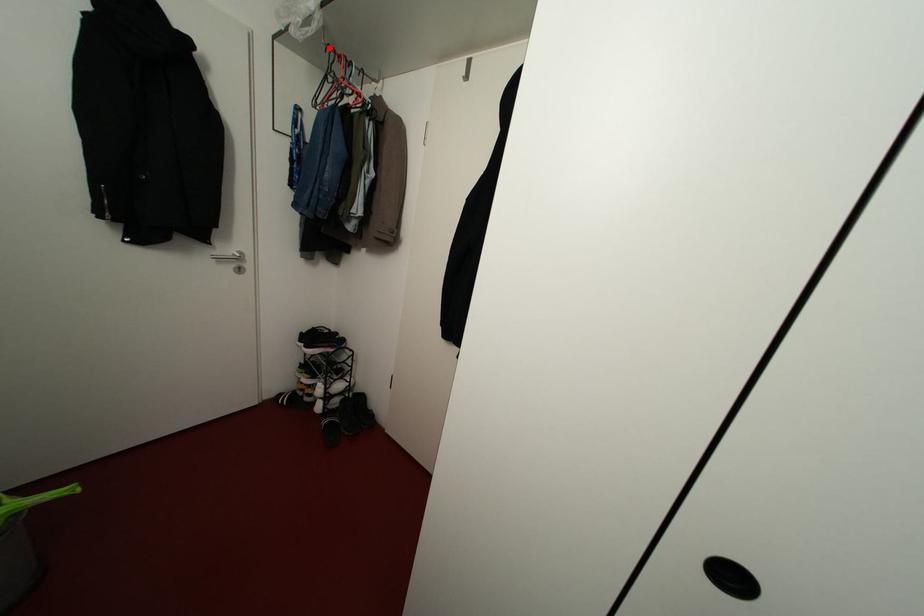
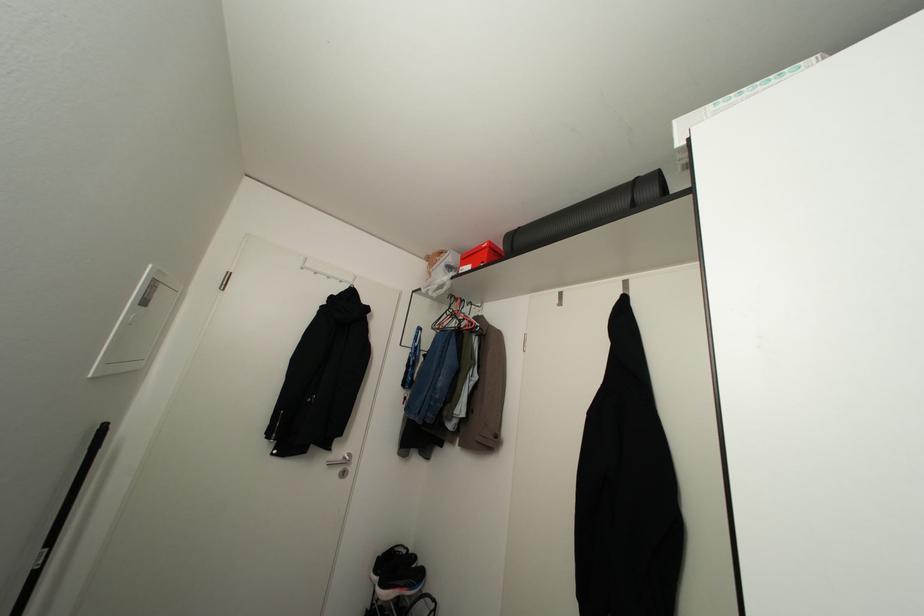
Where in the second image is the point corresponding to the highlighted location from the first image?

(451, 294)